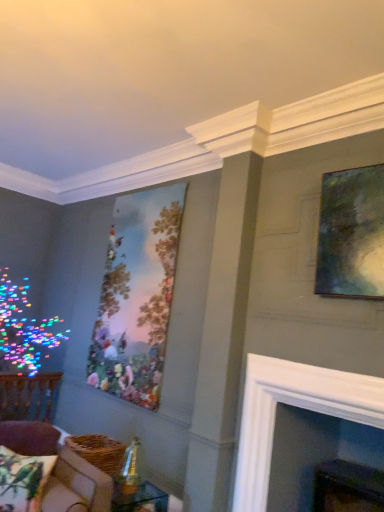
Find the location of a particular element. clear glass table at lower center is located at coordinates (140, 499).

This screenshot has width=384, height=512. I want to click on white glossy fireplace at center, so click(x=297, y=406).

Locate an element on the screen. metallic green painting at upper right, which ranks as the 2th picture frame in back-to-front order is located at coordinates (351, 234).

Image resolution: width=384 pixels, height=512 pixels. Identify the location of printed fabric pillow with parrots at lower left. (23, 480).

Identify the location of velvet brown couch at lower left. (76, 486).

Locate an element on the screen. table below the metallic green painting at upper right, marked as the 2th picture frame in a left-to-right arrangement (from a real-world perspective) is located at coordinates (140, 499).

Is clear glass table at lower center positioned far away from metallic green painting at upper right, which ranks as the 2th picture frame in back-to-front order?

That's right, there is a large distance between clear glass table at lower center and metallic green painting at upper right, which ranks as the 2th picture frame in back-to-front order.

Consider the image. From the image's perspective, does clear glass table at lower center appear lower than metallic green painting at upper right, which is the first picture frame in right-to-left order?

Indeed, from the image's perspective, clear glass table at lower center is shown beneath metallic green painting at upper right, which is the first picture frame in right-to-left order.

Between clear glass table at lower center and metallic green painting at upper right, which is the 1th picture frame from front to back, which one has less height?

clear glass table at lower center.

From a real-world perspective, is matte canvas painting at center-left, arranged as the second picture frame when viewed from the front, located higher than white glossy fireplace at center?

Yes, from a real-world perspective, matte canvas painting at center-left, arranged as the second picture frame when viewed from the front, is above white glossy fireplace at center.

Does matte canvas painting at center-left, arranged as the second picture frame when viewed from the front, have a greater width compared to white glossy fireplace at center?

In fact, matte canvas painting at center-left, arranged as the second picture frame when viewed from the front, might be narrower than white glossy fireplace at center.

Between matte canvas painting at center-left, the first picture frame positioned from the back, and white glossy fireplace at center, which one appears on the left side from the viewer's perspective?

matte canvas painting at center-left, the first picture frame positioned from the back.

Is velvet brown couch at lower left at the back of matte canvas painting at center-left, arranged as the second picture frame when viewed from the front?

No, matte canvas painting at center-left, arranged as the second picture frame when viewed from the front, is not facing away from velvet brown couch at lower left.

Where is `couch below the matte canvas painting at center-left, the first picture frame when ordered from left to right (from a real-world perspective)`? This screenshot has height=512, width=384. couch below the matte canvas painting at center-left, the first picture frame when ordered from left to right (from a real-world perspective) is located at coordinates (76, 486).

Who is taller, matte canvas painting at center-left, the first picture frame when ordered from left to right, or velvet brown couch at lower left?

With more height is matte canvas painting at center-left, the first picture frame when ordered from left to right.

Find the location of `fireplace above the printed fabric pillow with parrots at lower left (from the image's perspective)`. fireplace above the printed fabric pillow with parrots at lower left (from the image's perspective) is located at coordinates (297, 406).

Is the surface of printed fabric pillow with parrots at lower left in direct contact with white glossy fireplace at center?

No, printed fabric pillow with parrots at lower left is not with white glossy fireplace at center.

Looking at this image, considering the sizes of objects printed fabric pillow with parrots at lower left and white glossy fireplace at center in the image provided, who is thinner, printed fabric pillow with parrots at lower left or white glossy fireplace at center?

printed fabric pillow with parrots at lower left.

Considering the positions of points (19, 494) and (40, 447), is point (19, 494) closer to camera compared to point (40, 447)?

Yes, it is.

From a real-world perspective, between printed fabric pillow with parrots at lower left and velvet brown couch at lower left, who is vertically higher?

printed fabric pillow with parrots at lower left.

Where is `pillow above the velvet brown couch at lower left (from the image's perspective)`? Image resolution: width=384 pixels, height=512 pixels. pillow above the velvet brown couch at lower left (from the image's perspective) is located at coordinates (23, 480).

From a real-world perspective, which is physically below, metallic green painting at upper right, marked as the 2th picture frame in a left-to-right arrangement, or white glossy fireplace at center?

white glossy fireplace at center is physically lower.

Is metallic green painting at upper right, which is the 1th picture frame from front to back, facing away from white glossy fireplace at center?

No, white glossy fireplace at center is not at the back of metallic green painting at upper right, which is the 1th picture frame from front to back.

From a real-world perspective, is metallic green painting at upper right, which is the first picture frame in right-to-left order, physically located above or below printed fabric pillow with parrots at lower left?

Clearly, from a real-world perspective, metallic green painting at upper right, which is the first picture frame in right-to-left order, is above printed fabric pillow with parrots at lower left.

Is metallic green painting at upper right, which is the first picture frame in right-to-left order, bigger than printed fabric pillow with parrots at lower left?

Yes, metallic green painting at upper right, which is the first picture frame in right-to-left order, is bigger than printed fabric pillow with parrots at lower left.

Is metallic green painting at upper right, which is the first picture frame in right-to-left order, oriented towards printed fabric pillow with parrots at lower left?

No, metallic green painting at upper right, which is the first picture frame in right-to-left order, is not facing towards printed fabric pillow with parrots at lower left.

Is there a large distance between metallic green painting at upper right, which ranks as the 2th picture frame in back-to-front order, and printed fabric pillow with parrots at lower left?

metallic green painting at upper right, which ranks as the 2th picture frame in back-to-front order, is positioned a significant distance from printed fabric pillow with parrots at lower left.

I want to click on table below the metallic green painting at upper right, marked as the 2th picture frame in a left-to-right arrangement (from a real-world perspective), so click(x=140, y=499).

This screenshot has height=512, width=384. There is a white glossy fireplace at center. Find the location of `the 1st picture frame above it (from a real-world perspective)`. the 1st picture frame above it (from a real-world perspective) is located at coordinates (137, 295).

Looking at the image, which one is located further to white glossy fireplace at center, velvet brown couch at lower left or matte canvas painting at center-left, the first picture frame when ordered from left to right?

matte canvas painting at center-left, the first picture frame when ordered from left to right, is positioned further to the anchor white glossy fireplace at center.

From the image, which object appears to be nearer to printed fabric pillow with parrots at lower left, metallic green painting at upper right, which ranks as the 2th picture frame in back-to-front order, or velvet brown couch at lower left?

velvet brown couch at lower left is closer to printed fabric pillow with parrots at lower left.

Looking at the image, which one is located further to metallic green painting at upper right, marked as the 2th picture frame in a left-to-right arrangement, white glossy fireplace at center or matte canvas painting at center-left, the first picture frame positioned from the back?

matte canvas painting at center-left, the first picture frame positioned from the back, lies further to metallic green painting at upper right, marked as the 2th picture frame in a left-to-right arrangement, than the other object.

Estimate the real-world distances between objects in this image. Which object is closer to velvet brown couch at lower left, printed fabric pillow with parrots at lower left or clear glass table at lower center?

printed fabric pillow with parrots at lower left is closer to velvet brown couch at lower left.

Considering their positions, is printed fabric pillow with parrots at lower left positioned closer to clear glass table at lower center than velvet brown couch at lower left?

velvet brown couch at lower left is closer to clear glass table at lower center.

When comparing their distances from clear glass table at lower center, does printed fabric pillow with parrots at lower left or white glossy fireplace at center seem closer?

printed fabric pillow with parrots at lower left.

When comparing their distances from metallic green painting at upper right, which is the 1th picture frame from front to back, does velvet brown couch at lower left or printed fabric pillow with parrots at lower left seem further?

printed fabric pillow with parrots at lower left lies further to metallic green painting at upper right, which is the 1th picture frame from front to back, than the other object.

Considering their positions, is metallic green painting at upper right, which is the first picture frame in right-to-left order, positioned closer to printed fabric pillow with parrots at lower left than matte canvas painting at center-left, arranged as the second picture frame when viewed from the front?

matte canvas painting at center-left, arranged as the second picture frame when viewed from the front, is closer to printed fabric pillow with parrots at lower left.

At what (x,y) coordinates should I click in order to perform the action: click on fireplace between metallic green painting at upper right, marked as the 2th picture frame in a left-to-right arrangement, and clear glass table at lower center vertically. Please return your answer as a coordinate pair (x, y). This screenshot has height=512, width=384. Looking at the image, I should click on (297, 406).

Where is `table between printed fabric pillow with parrots at lower left and white glossy fireplace at center from left to right`? Image resolution: width=384 pixels, height=512 pixels. table between printed fabric pillow with parrots at lower left and white glossy fireplace at center from left to right is located at coordinates (140, 499).

I want to click on picture frame between printed fabric pillow with parrots at lower left and metallic green painting at upper right, which is the 1th picture frame from front to back, in the horizontal direction, so click(137, 295).

The image size is (384, 512). Identify the location of table located between velvet brown couch at lower left and white glossy fireplace at center in the left-right direction. (140, 499).